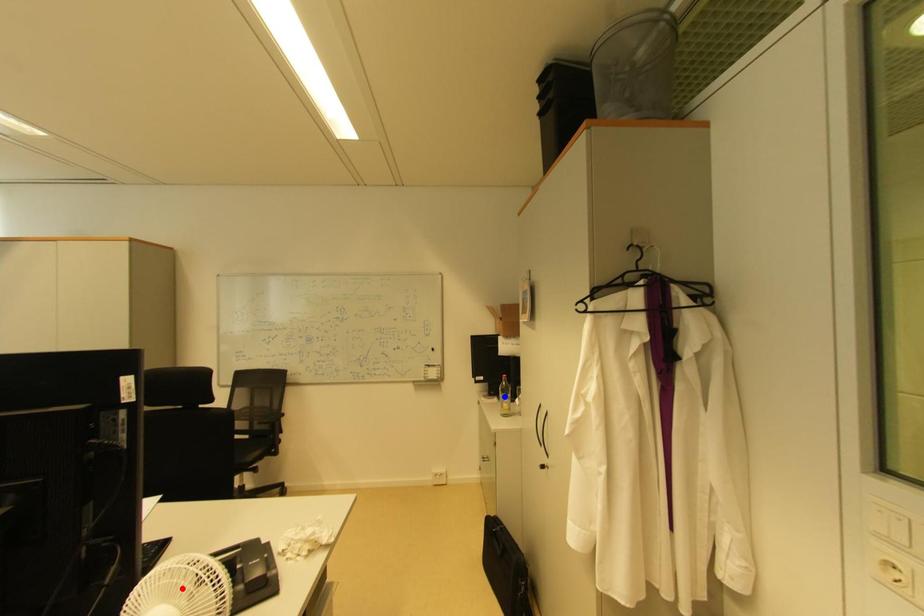
Question: Which of the two points in the image is closer to the camera?

Choices:
 (A) Blue point is closer.
 (B) Red point is closer.

Answer: (B)